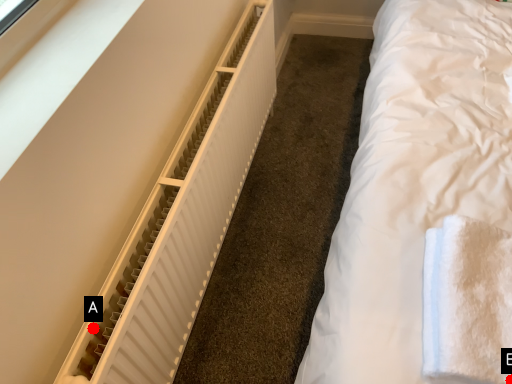
Question: Two points are circled on the image, labeled by A and B beside each circle. Which of the following is the closest to the observer?

Choices:
 (A) A is closer
 (B) B is closer

Answer: (B)